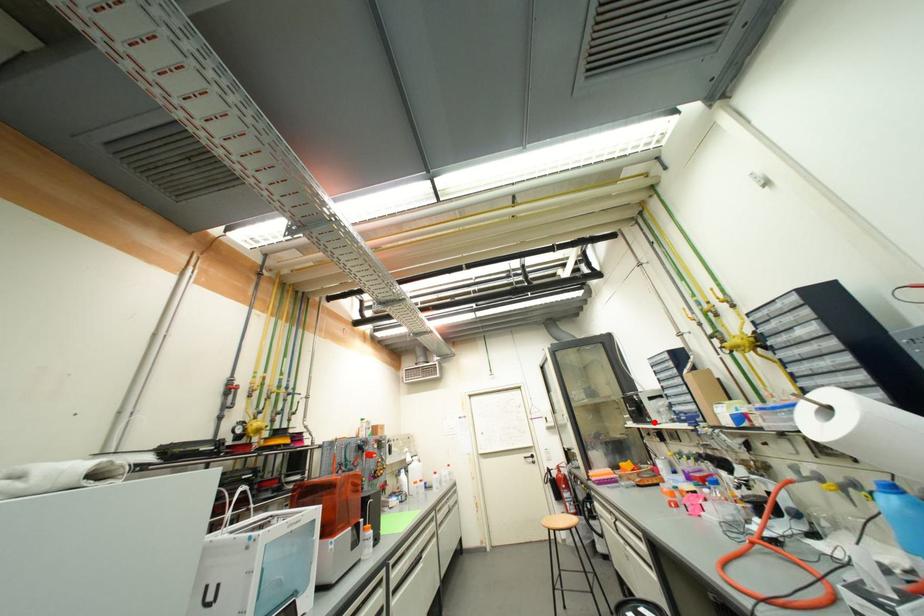
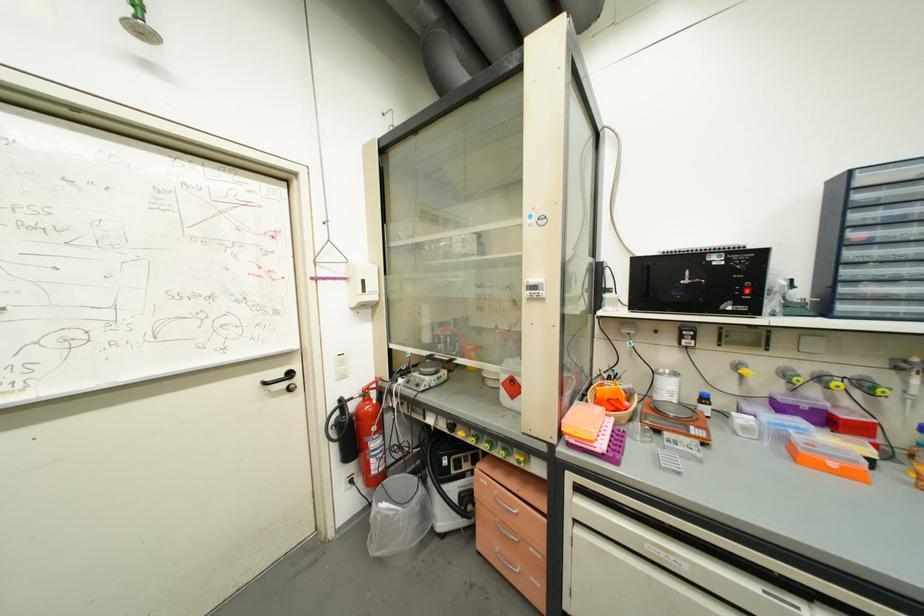
Question: I am providing you with two images of the same scene from different viewpoints. Given a red point in image1, look at the same physical point in image2. Is it:

Choices:
 (A) Closer to the viewpoint
 (B) Farther from the viewpoint

Answer: (A)